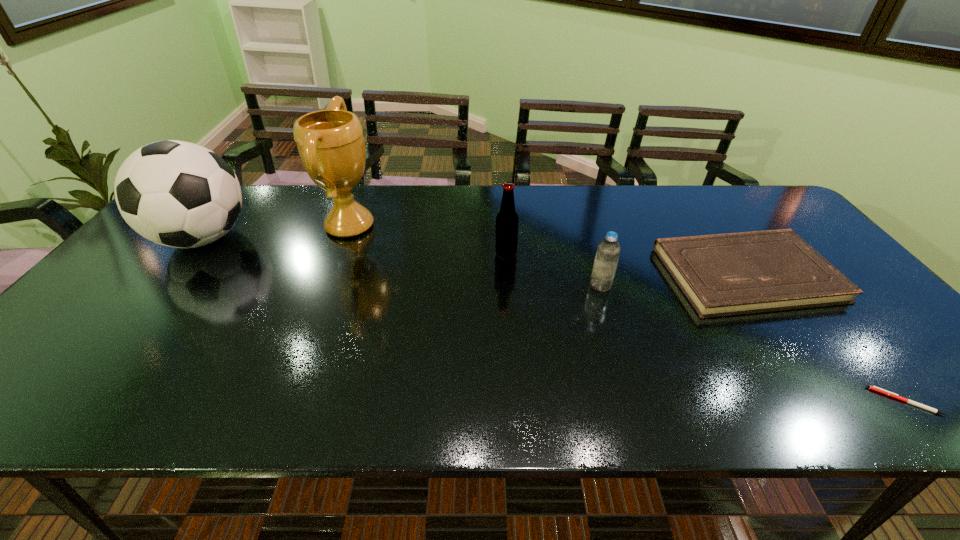
You are a GUI agent. You are given a task and a screenshot of the screen. Output one action in this format:
    pyautogui.click(x=<x>, y=<y>)
    Task: Click on the shortest object
    
    Given the screenshot: What is the action you would take?
    pyautogui.click(x=874, y=388)

Find the location of a particular element. The image size is (960, 540). free space located on the front of the tallest object with the decoration is located at coordinates (401, 226).

Find the location of `vacant region located 0.110m on the right of the fifth shortest object`. vacant region located 0.110m on the right of the fifth shortest object is located at coordinates (290, 238).

At what (x,y) coordinates should I click in order to perform the action: click on vacant area situated on the left of the beer bottle. Please return your answer as a coordinate pair (x, y). This screenshot has height=540, width=960. Looking at the image, I should click on (449, 254).

You are a GUI agent. You are given a task and a screenshot of the screen. Output one action in this format:
    pyautogui.click(x=<x>, y=<y>)
    Task: Click on the blank space located on the back of the third object from right to left
    The height and width of the screenshot is (540, 960).
    Given the screenshot: What is the action you would take?
    tap(592, 257)

This screenshot has width=960, height=540. I want to click on vacant region located on the back of the paperback book, so click(x=695, y=201).

What are the coordinates of `vacant space located on the clicker of the pen` in the screenshot? It's located at (767, 401).

The width and height of the screenshot is (960, 540). Find the location of `vacant space located on the clicker of the pen`. vacant space located on the clicker of the pen is located at coordinates (836, 401).

This screenshot has width=960, height=540. Find the location of `vacant space located 0.230m on the clicker of the pen`. vacant space located 0.230m on the clicker of the pen is located at coordinates (762, 401).

Locate an element on the screen. The width and height of the screenshot is (960, 540). award situated at the far edge is located at coordinates (330, 142).